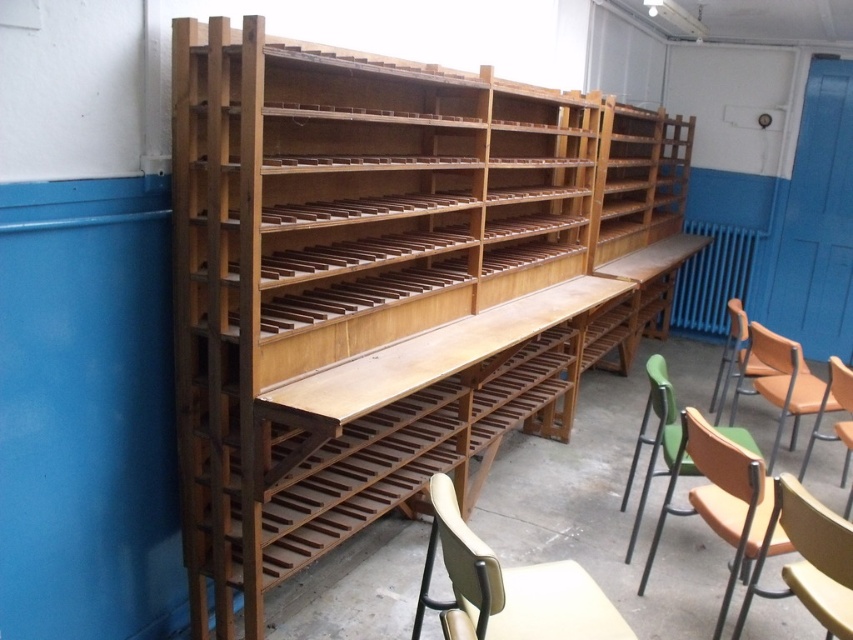
Question: Which point is closer to the camera?

Choices:
 (A) green plastic chair at lower right
 (B) wooden chair at right

Answer: (A)

Question: Considering the relative positions of light brown wood chair at lower right and wooden chair at right in the image provided, where is light brown wood chair at lower right located with respect to wooden chair at right?

Choices:
 (A) right
 (B) left

Answer: (B)

Question: Can you confirm if natural wood bookshelf at center is wider than matte orange chair at right?

Choices:
 (A) no
 (B) yes

Answer: (B)

Question: Which object appears closest to the camera in this image?

Choices:
 (A) light beige plastic chair at lower right
 (B) light brown wood chair at lower right
 (C) green plastic chair at right
 (D) wooden chair at right

Answer: (A)

Question: Is matte orange chair at right positioned at the back of wooden chair at right?

Choices:
 (A) no
 (B) yes

Answer: (B)

Question: Which point is closer to the camera?

Choices:
 (A) (827, 632)
 (B) (788, 392)
 (C) (468, 614)

Answer: (C)